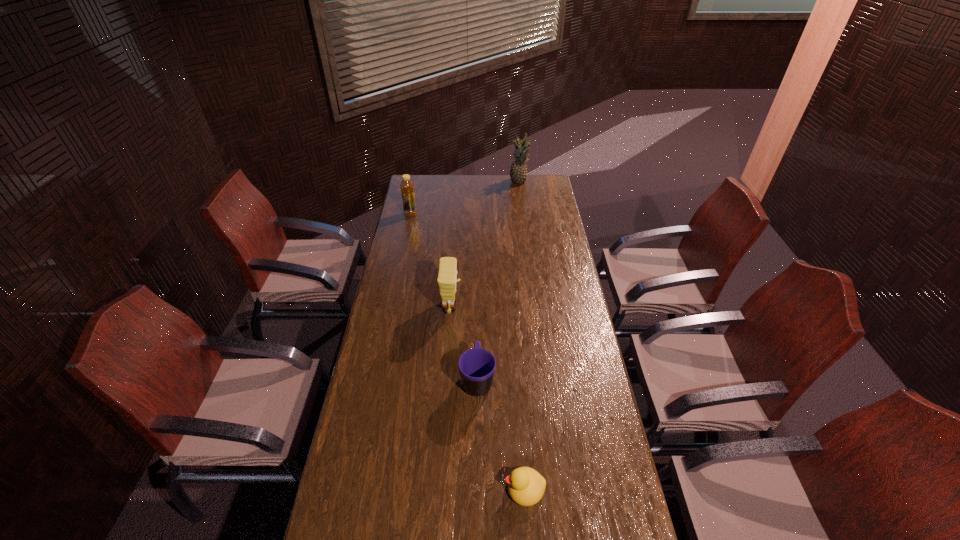
I want to click on the farthest object, so click(518, 173).

Identify the location of pineapple. (518, 173).

Find the location of `bottle`. bottle is located at coordinates (407, 188).

Image resolution: width=960 pixels, height=540 pixels. I want to click on the leftmost object, so click(x=407, y=188).

In order to click on the third nearest object in this screenshot , I will do `click(447, 270)`.

Image resolution: width=960 pixels, height=540 pixels. I want to click on sponge, so click(447, 270).

You are a GUI agent. You are given a task and a screenshot of the screen. Output one action in this format:
    pyautogui.click(x=<x>, y=<y>)
    Task: Click on the third object from right to left
    The width and height of the screenshot is (960, 540).
    Given the screenshot: What is the action you would take?
    pyautogui.click(x=476, y=366)

Locate an element on the screen. mug is located at coordinates (476, 366).

This screenshot has width=960, height=540. In order to click on the shortest object in this screenshot , I will do `click(526, 486)`.

Locate an element on the screen. The width and height of the screenshot is (960, 540). the nearest object is located at coordinates (526, 486).